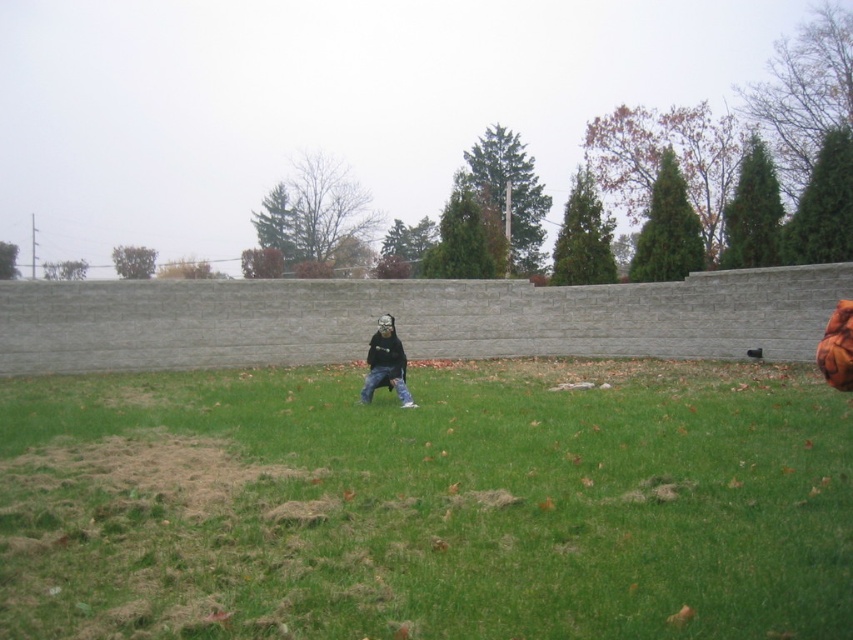
Measure the distance between green grass at center and camera.

11.85 feet

Who is taller, green grass at center or matte black mask at center?

Standing taller between the two is matte black mask at center.

Does point (115, 484) come closer to viewer compared to point (375, 339)?

Yes, point (115, 484) is in front of point (375, 339).

The width and height of the screenshot is (853, 640). I want to click on green grass at center, so click(428, 502).